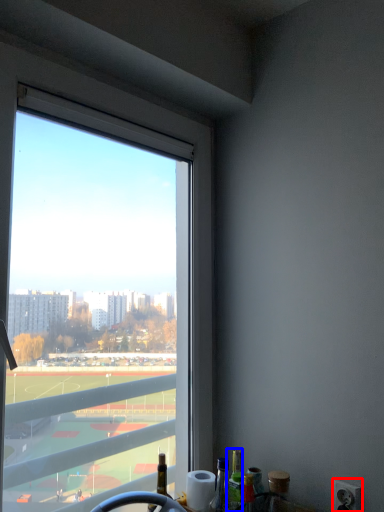
Question: Which object is closer to the camera taking this photo, power outlet (highlighted by a red box) or bottle (highlighted by a blue box)?

Choices:
 (A) power outlet
 (B) bottle

Answer: (A)